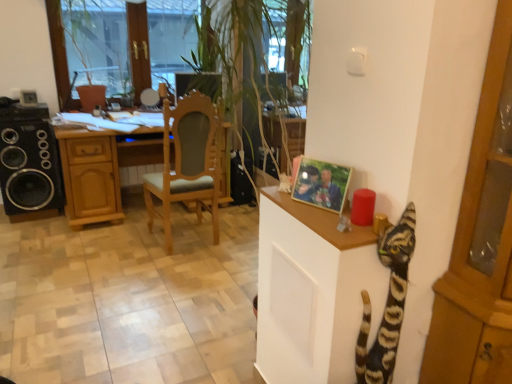
Locate an element on the screen. vacant space underneath light brown wood chair at center (from a real-world perspective) is located at coordinates (185, 243).